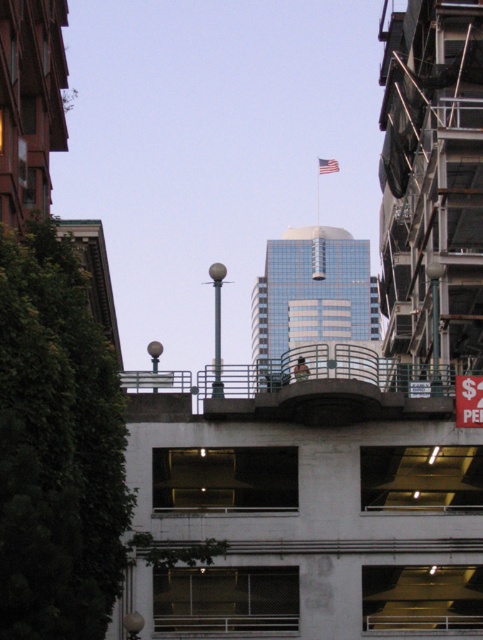
Can you confirm if white concrete parking garage at center is bigger than glassy reflective skyscraper at center?

No.

Does white concrete parking garage at center appear on the right side of glassy reflective skyscraper at center?

In fact, white concrete parking garage at center is to the left of glassy reflective skyscraper at center.

Between point (366, 547) and point (300, 230), which one is positioned behind?

The point (300, 230) is behind.

At what (x,y) coordinates should I click in order to perform the action: click on white concrete parking garage at center. Please return your answer as a coordinate pair (x, y). This screenshot has width=483, height=640. Looking at the image, I should click on pos(306,500).

Identify the location of glassy reflective skyscraper at center. The width and height of the screenshot is (483, 640). coord(312,298).

Can you confirm if glassy reflective skyscraper at center is positioned to the left of red fabric flag at upper center?

Correct, you'll find glassy reflective skyscraper at center to the left of red fabric flag at upper center.

Image resolution: width=483 pixels, height=640 pixels. Identify the location of glassy reflective skyscraper at center. (312, 298).

Is point (241, 536) positioned before point (324, 166)?

Yes.

This screenshot has width=483, height=640. I want to click on white concrete parking garage at center, so [x=306, y=500].

Who is more forward, (201, 412) or (328, 166)?

Positioned in front is point (201, 412).

The image size is (483, 640). I want to click on white concrete parking garage at center, so click(306, 500).